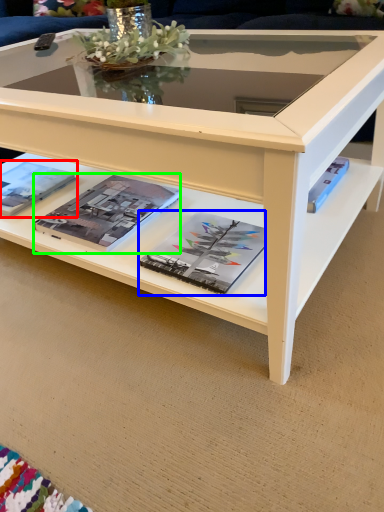
Question: Which object is the closest to the magazine (highlighted by a red box)? Choose among these: magazine (highlighted by a blue box) or magazine (highlighted by a green box).

Choices:
 (A) magazine
 (B) magazine

Answer: (B)